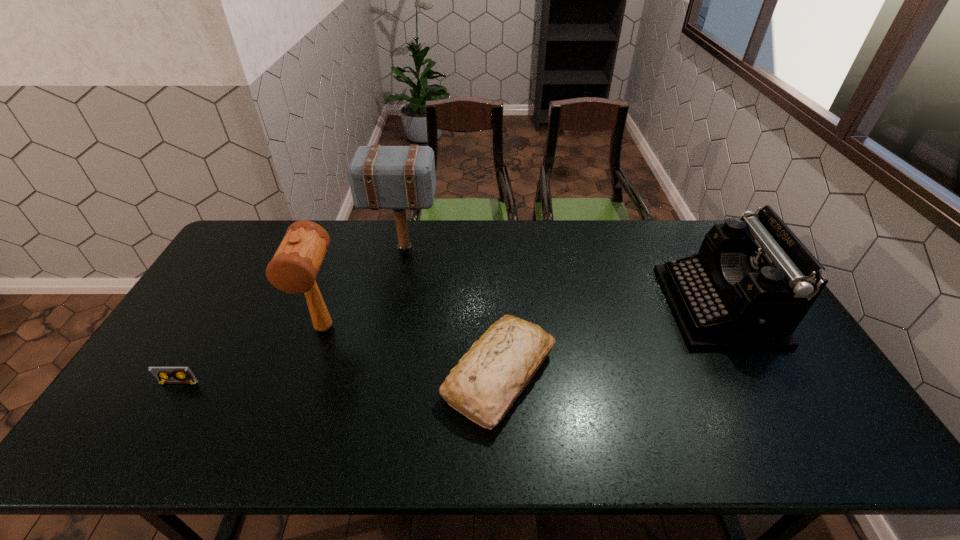
Where is `object at the right edge`? This screenshot has height=540, width=960. object at the right edge is located at coordinates (752, 282).

Where is `free point at the far edge`? free point at the far edge is located at coordinates (516, 225).

The width and height of the screenshot is (960, 540). I want to click on vacant space at the left edge of the desktop, so click(198, 326).

Locate an element on the screen. Image resolution: width=960 pixels, height=540 pixels. free region at the near right corner of the desktop is located at coordinates (853, 438).

The height and width of the screenshot is (540, 960). What are the coordinates of `vacant area that lies between the farther mallet and the left mallet` in the screenshot? It's located at (364, 289).

Where is `free space between the farther mallet and the left mallet`? free space between the farther mallet and the left mallet is located at coordinates (364, 289).

Where is `free space between the leftmost object and the left mallet`? free space between the leftmost object and the left mallet is located at coordinates (252, 355).

Where is `empty space that is in between the second object from right to left and the rightmost object`? This screenshot has height=540, width=960. empty space that is in between the second object from right to left and the rightmost object is located at coordinates (609, 341).

Where is `vacant space that is in between the third object from left to right and the second object from left to right`? Image resolution: width=960 pixels, height=540 pixels. vacant space that is in between the third object from left to right and the second object from left to right is located at coordinates (364, 289).

Locate an element on the screen. free space between the videotape and the farther mallet is located at coordinates (292, 317).